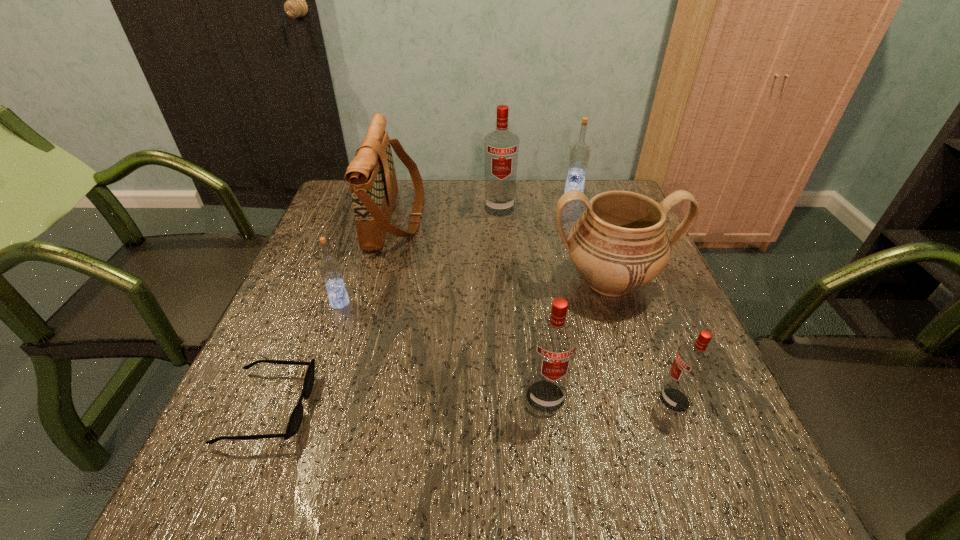
The height and width of the screenshot is (540, 960). In order to click on the nearer blue vodka in this screenshot , I will do `click(330, 268)`.

The image size is (960, 540). Find the location of `black sunglasses`. black sunglasses is located at coordinates (295, 419).

This screenshot has width=960, height=540. In order to click on the shortest object in this screenshot , I will do `click(295, 419)`.

At what (x,y) coordinates should I click in order to perform the action: click on free space located 0.260m on the front label of the fourth nearest vodka. Please return your answer as a coordinate pair (x, y). This screenshot has height=540, width=960. Looking at the image, I should click on (503, 277).

Image resolution: width=960 pixels, height=540 pixels. Identify the location of vacant point located on the front-facing side of the shoulder bag. (527, 218).

What are the coordinates of `vacant region located 0.080m on the right of the farthest vodka` in the screenshot? It's located at (610, 195).

Identify the location of blank space located 0.090m on the front label of the second smallest red vodka. (554, 463).

This screenshot has height=540, width=960. Identify the location of vacant space located on the front-facing side of the urn. (657, 426).

Locate an element on the screen. vacant space located 0.130m on the front label of the rightmost vodka is located at coordinates (588, 400).

The width and height of the screenshot is (960, 540). In order to click on free region located 0.330m on the front label of the rightmost vodka in this screenshot , I will do `click(479, 400)`.